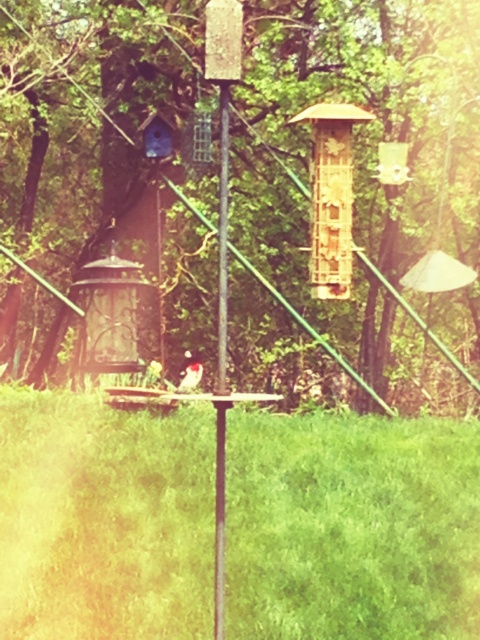
You are a birdhouse builder who needs to ensure the pole can support the weight of the bird. Given the smooth wood pole at center and the white fluffy bird at center, which object has a greater width?

The white fluffy bird at center has a greater width than the smooth wood pole at center.

You are a bird trying to land on the brown wooden birdhouse at center. The smooth wood pole at center is in your flight path. Will you have to adjust your flight path to avoid it?

The smooth wood pole at center is behind brown wooden birdhouse at center, so you will not need to adjust your flight path to avoid it.

You are a bird enthusiast who wants to observe the white fluffy bird at center without disturbing it. The brown wooden birdhouse at center is your vantage point. What is the minimum distance you must maintain to ensure you don not startle the bird?

The minimum distance you must maintain is 7.72 feet from the white fluffy bird at center to avoid startling it, as the birdhouse is 7.72 feet away from the bird.